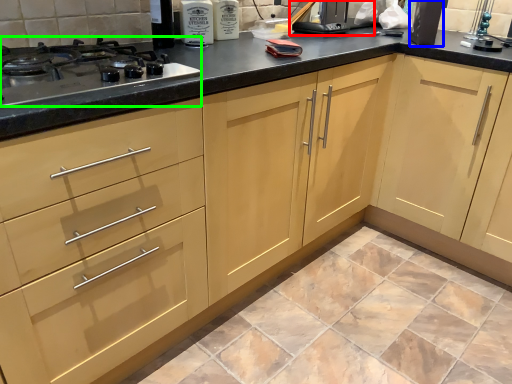
Question: Which is farther away from appliance (highlighted by a red box)? appliance (highlighted by a blue box) or gas stove (highlighted by a green box)?

Choices:
 (A) appliance
 (B) gas stove

Answer: (B)